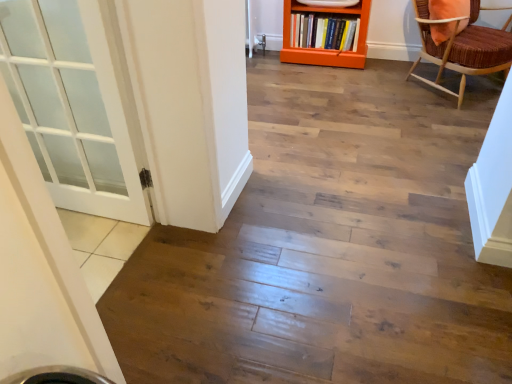
Question: Is orange wood bookcase at upper center smaller than brown woven chair at upper right?

Choices:
 (A) no
 (B) yes

Answer: (B)

Question: Can you confirm if orange wood bookcase at upper center is positioned to the right of brown woven chair at upper right?

Choices:
 (A) no
 (B) yes

Answer: (A)

Question: Is the surface of orange wood bookcase at upper center in direct contact with brown woven chair at upper right?

Choices:
 (A) no
 (B) yes

Answer: (A)

Question: Is orange wood bookcase at upper center positioned before brown woven chair at upper right?

Choices:
 (A) yes
 (B) no

Answer: (B)

Question: Does orange wood bookcase at upper center turn towards brown woven chair at upper right?

Choices:
 (A) no
 (B) yes

Answer: (A)

Question: From the image's perspective, is orange wood bookcase at upper center located above or below brown woven chair at upper right?

Choices:
 (A) above
 (B) below

Answer: (A)

Question: From a real-world perspective, is orange wood bookcase at upper center above or below brown woven chair at upper right?

Choices:
 (A) above
 (B) below

Answer: (B)

Question: Considering their positions, is orange wood bookcase at upper center located in front of or behind brown woven chair at upper right?

Choices:
 (A) front
 (B) behind

Answer: (B)

Question: Looking at the image, does orange wood bookcase at upper center seem bigger or smaller compared to brown woven chair at upper right?

Choices:
 (A) big
 (B) small

Answer: (B)

Question: From a real-world perspective, relative to hardcover book at center, is orange wood bookcase at upper center vertically above or below?

Choices:
 (A) below
 (B) above

Answer: (B)

Question: From their relative heights in the image, would you say orange wood bookcase at upper center is taller or shorter than hardcover book at center?

Choices:
 (A) tall
 (B) short

Answer: (A)

Question: Would you say orange wood bookcase at upper center is to the left or to the right of hardcover book at center in the picture?

Choices:
 (A) left
 (B) right

Answer: (A)

Question: From the image's perspective, relative to hardcover book at center, is orange wood bookcase at upper center above or below?

Choices:
 (A) below
 (B) above

Answer: (A)

Question: Considering the positions of brown woven chair at upper right and hardcover book at center in the image, is brown woven chair at upper right wider or thinner than hardcover book at center?

Choices:
 (A) thin
 (B) wide

Answer: (B)

Question: Based on their sizes in the image, would you say brown woven chair at upper right is bigger or smaller than hardcover book at center?

Choices:
 (A) small
 (B) big

Answer: (B)